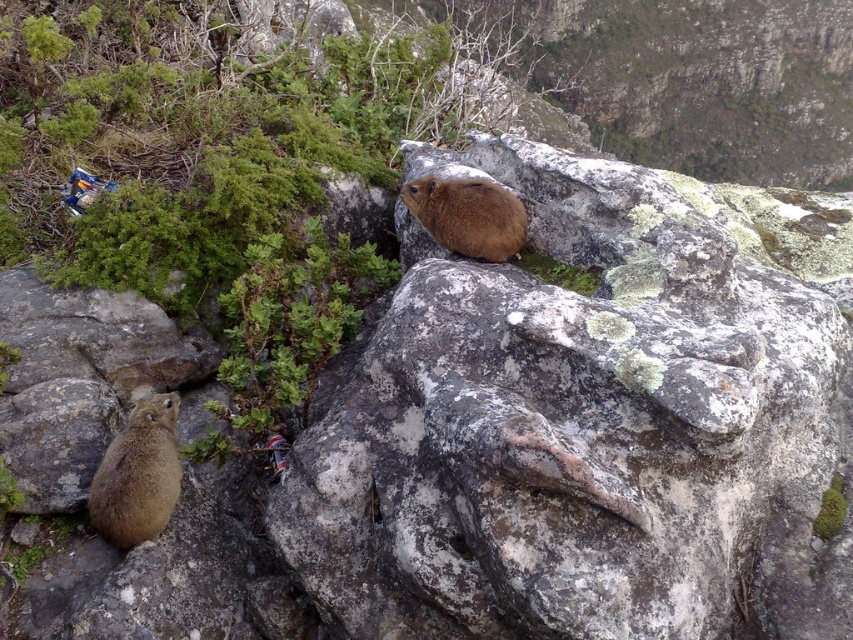
Who is shorter, brown furry squirrel at lower left or brown furry rock hyrax at center?

brown furry rock hyrax at center

Is brown furry squirrel at lower left above brown furry rock hyrax at center?

No.

Is point (90, 496) positioned behind point (447, 250)?

No, (90, 496) is in front of (447, 250).

The width and height of the screenshot is (853, 640). Find the location of `brown furry squirrel at lower left`. brown furry squirrel at lower left is located at coordinates (138, 474).